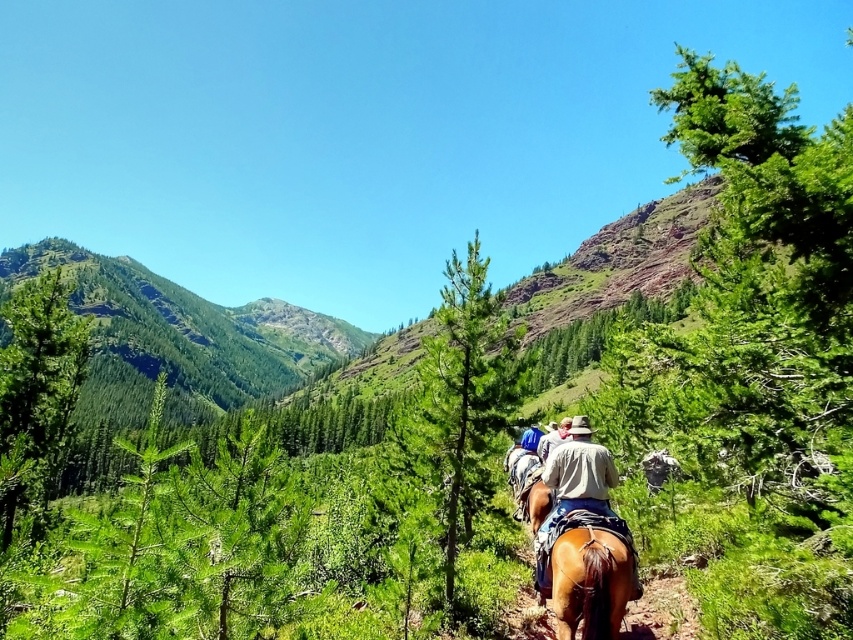
From the picture: Who is more distant from viewer, (548, 595) or (544, 444)?

The point (544, 444) is behind.

Does brown leather horse at center have a larger size compared to light brown leather jacket at center?

Actually, brown leather horse at center might be smaller than light brown leather jacket at center.

Who is more distant from viewer, (561,625) or (544,438)?

The point (544,438) is behind.

At what (x,y) coordinates should I click in order to perform the action: click on brown leather horse at center. Please return your answer as a coordinate pair (x, y). The image size is (853, 640). Looking at the image, I should click on (589, 573).